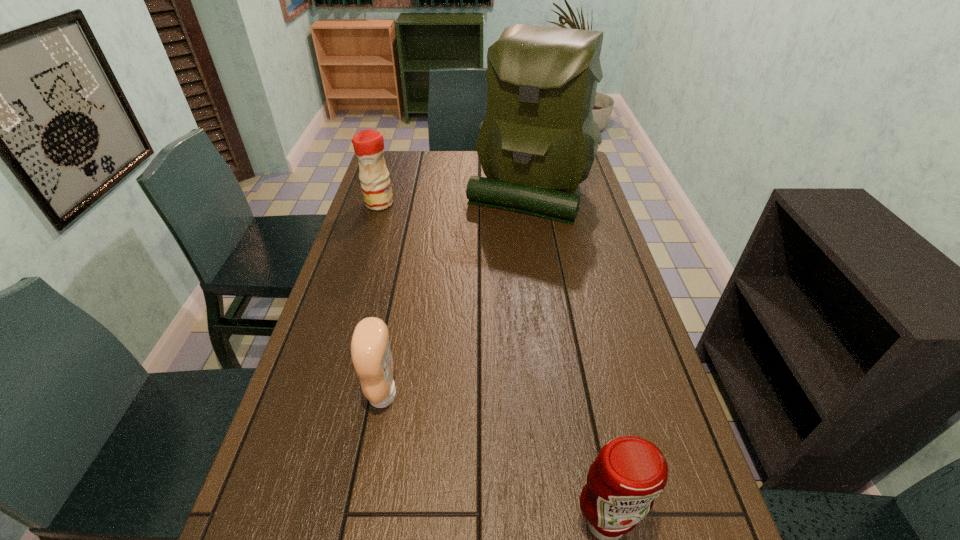
I want to click on backpack, so click(x=537, y=143).

Locate an element on the screen. The image size is (960, 540). the farthest condiment is located at coordinates (368, 145).

Find the location of a particular element. The image size is (960, 540). the leftmost object is located at coordinates (x=368, y=145).

The height and width of the screenshot is (540, 960). Find the location of `the third farthest object`. the third farthest object is located at coordinates (370, 349).

At what (x,y) coordinates should I click in order to perform the action: click on the second object from left to right. Please return your answer as a coordinate pair (x, y). Image resolution: width=960 pixels, height=540 pixels. Looking at the image, I should click on 370,349.

The image size is (960, 540). What are the coordinates of `vacant space located on the front of the tallest object with visible pockets` in the screenshot? It's located at (543, 284).

Where is `vacant region located 0.340m on the front of the leftmost condiment`? The width and height of the screenshot is (960, 540). vacant region located 0.340m on the front of the leftmost condiment is located at coordinates (357, 275).

In order to click on free location located 0.330m on the label of the second condiment from left to right in this screenshot , I will do `click(543, 395)`.

The height and width of the screenshot is (540, 960). Identify the location of object that is positioned at the far edge. (537, 143).

Image resolution: width=960 pixels, height=540 pixels. What are the coordinates of `object located at the left edge` in the screenshot? It's located at (368, 145).